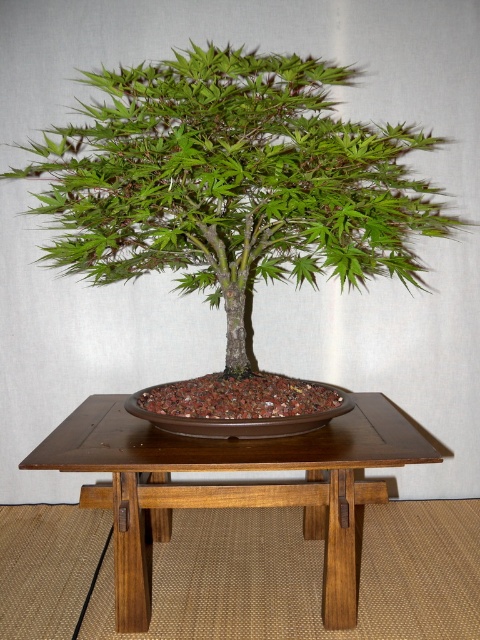
Consider the image. You are arranging a small decorative item on the brown wood table at center. You want to place it to the right of the green matte bonsai tree at center. Where should you place the item?

You should place the item to the right side of the green matte bonsai tree at center, which is also the right side of the brown wood table at center since the bonsai tree is to the left of the table.

You are a gardener who wants to place a new decorative item on the brown wood table at center. Considering the green matte bonsai tree at center is already there, will the new item fit on the table without being under the tree?

The green matte bonsai tree at center is much taller than the brown wood table at center, so the new item can be placed on the table without being under the tree as long as it is positioned outside the tree canopy.

You are a gardener who wants to place a new decorative stone on the brown wood table at center without covering the green matte bonsai tree at center. Is there enough space on the table for the stone?

The green matte bonsai tree at center is wider than the brown wood table at center, so placing a new decorative stone on the brown wood table at center without covering the tree may not be possible due to the tree already exceeding the table width.